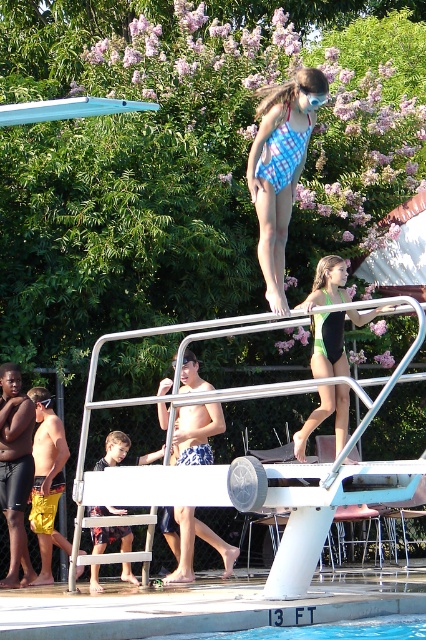
Question: Is blue smooth water at lower center closer to camera compared to dark blue shorts at center?

Choices:
 (A) yes
 (B) no

Answer: (A)

Question: Which object appears farthest from the camera in this image?

Choices:
 (A) blue plaid swimsuit at center
 (B) dark blue shorts at center
 (C) white metal rail at center
 (D) blue smooth water at lower center

Answer: (B)

Question: In this image, where is white metal rail at center located relative to green matte swimsuit at upper center?

Choices:
 (A) below
 (B) above

Answer: (A)

Question: Is blue plaid swimsuit at center positioned in front of blue smooth water at lower center?

Choices:
 (A) no
 (B) yes

Answer: (A)

Question: Which is farther from the blue plaid swimsuit at center?

Choices:
 (A) white metal rail at center
 (B) green matte swimsuit at upper center
 (C) dark blue shorts at center

Answer: (C)

Question: Which point is farther from the camera taking this photo?

Choices:
 (A) (279, 204)
 (B) (149, 458)

Answer: (B)